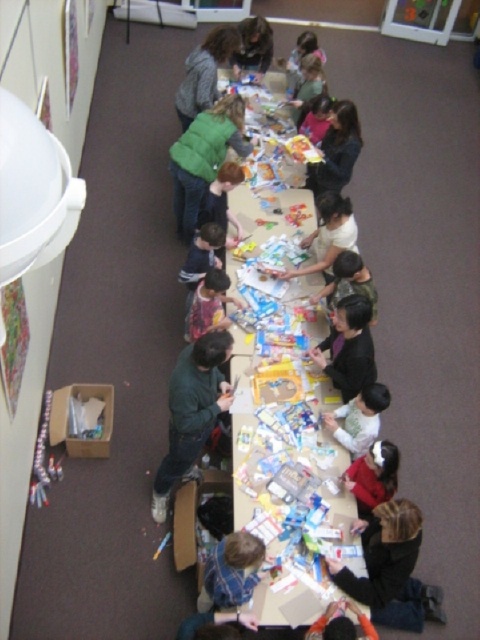
Based on the photo, you are a photographer standing at the entrance of the room. You want to take a photo of the matte green sweater at upper center without including the white paper table at center in the frame. Is this possible given their positions?

The white paper table at center is in front of the matte green sweater at upper center, so it would block the view. Therefore, you cannot take a photo of the matte green sweater at upper center without including the white paper table at center in the frame.

You are organizing a craft event and need to place a plaid shirt at center on the table. Given that the white paper table at center is larger than the shirt, will there be enough space left on the table for additional craft supplies?

The white paper table at center is larger in size than plaid shirt at center, so there will be sufficient space remaining on the table for additional craft supplies after placing the plaid shirt at center.